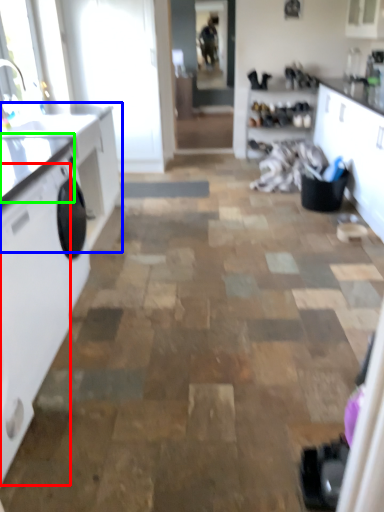
Question: Estimate the real-world distances between objects in this image. Which object is farther from washing machine (highlighted by a red box), countertop (highlighted by a blue box) or counter top (highlighted by a green box)?

Choices:
 (A) countertop
 (B) counter top

Answer: (A)